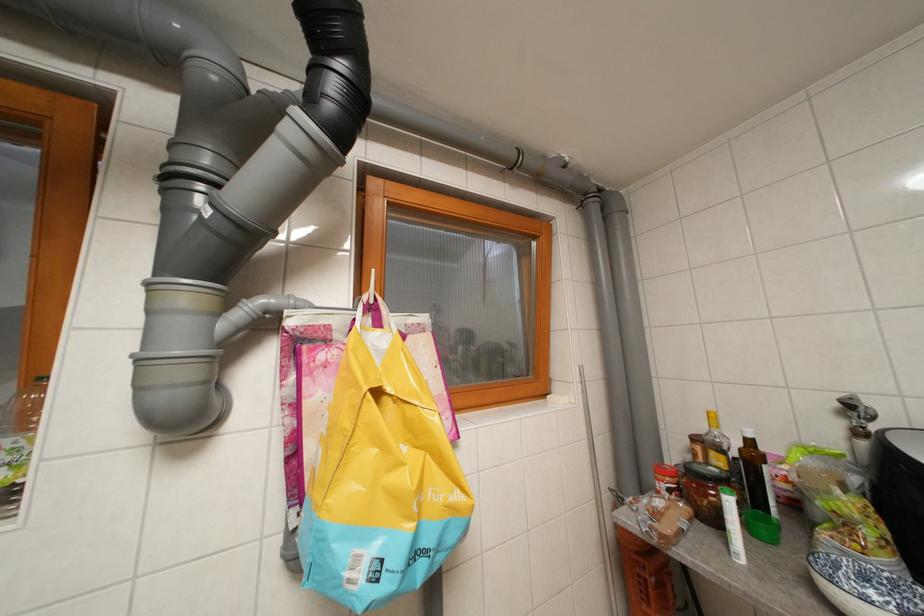
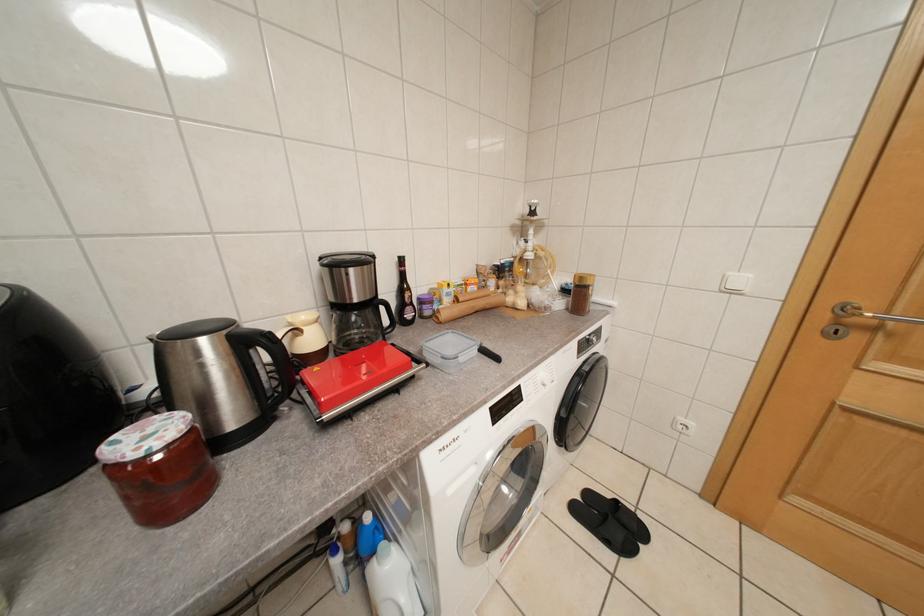
Question: The camera is either moving clockwise (left) or counter-clockwise (right) around the object. The first image is from the beginning of the video and the second image is from the end. Is the camera moving left or right when shooting the video?

Choices:
 (A) Left
 (B) Right

Answer: (A)